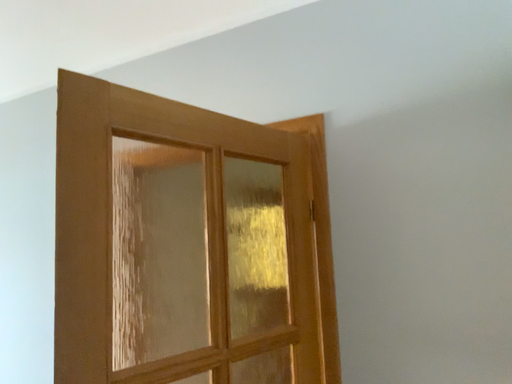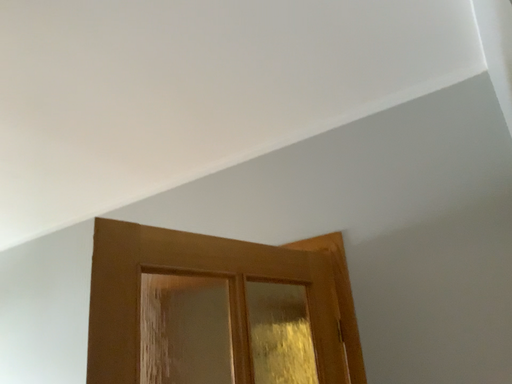
Question: How did the camera likely rotate when shooting the video?

Choices:
 (A) rotated upward
 (B) rotated downward

Answer: (A)